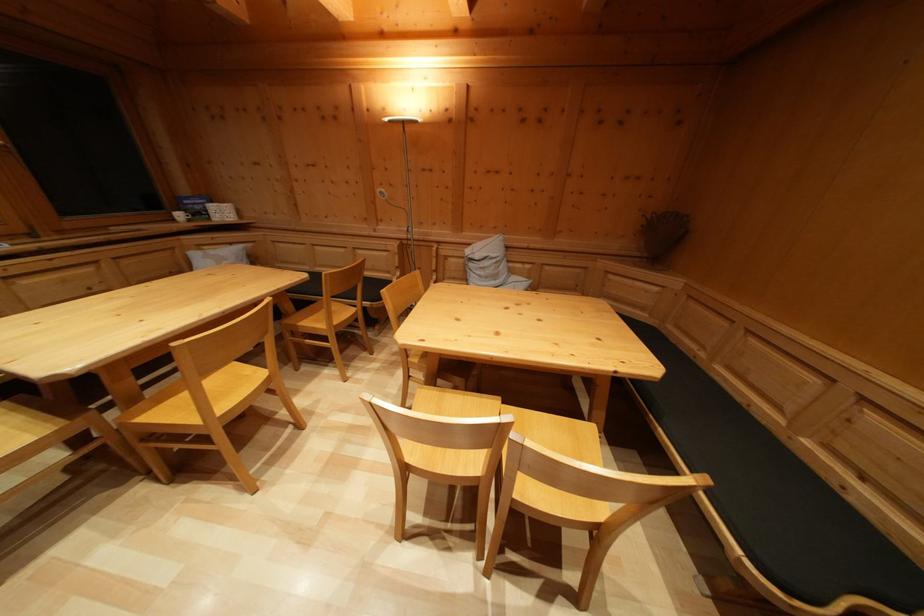
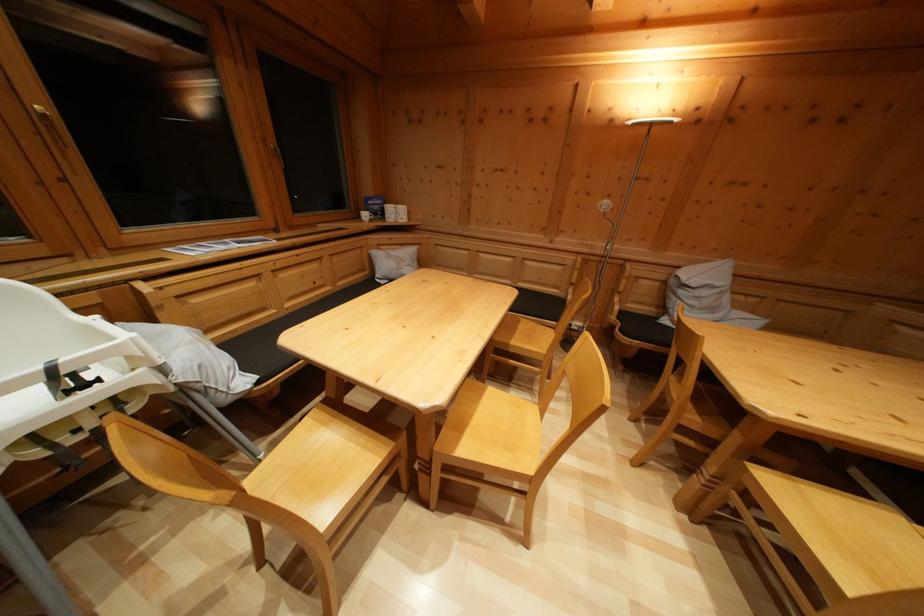
Question: What movement of the cameraman would produce the second image?

Choices:
 (A) Left
 (B) Right
 (C) Forward
 (D) Backward

Answer: (A)